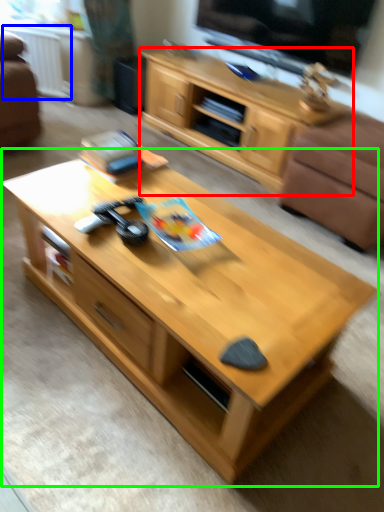
Question: Which object is the closest to the cabinetry (highlighted by a red box)? Choose among these: radiator (highlighted by a blue box) or coffee table (highlighted by a green box).

Choices:
 (A) radiator
 (B) coffee table

Answer: (A)